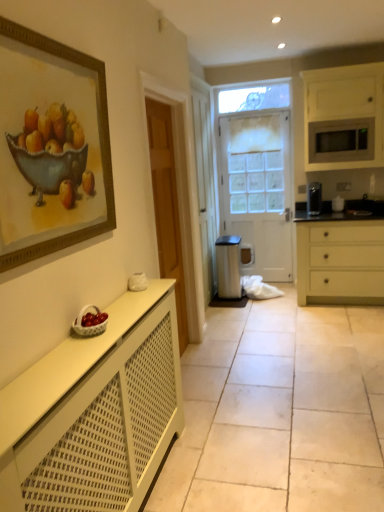
At what (x,y) coordinates should I click in order to perform the action: click on empty space that is ontop of white matte radiator at lower left, which is counted as the 2th cabinetry, starting from the right (from a real-world perspective). Please return your answer as a coordinate pair (x, y). Looking at the image, I should click on (69, 344).